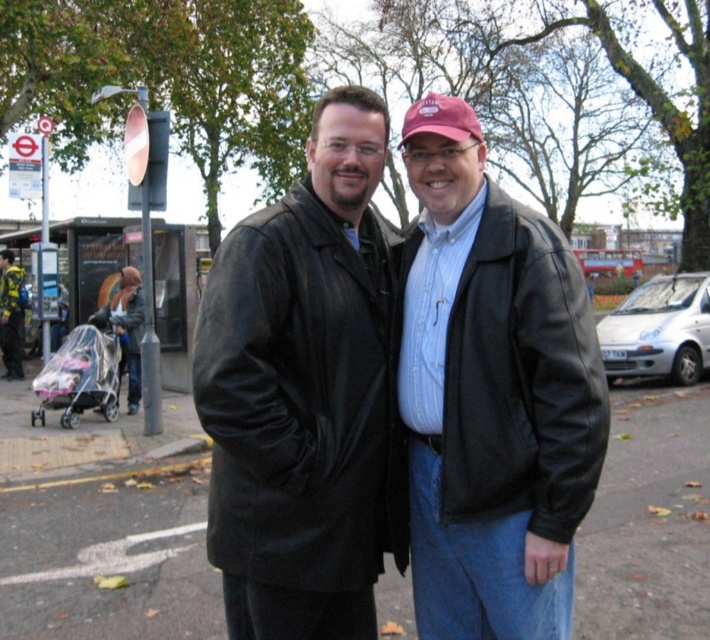
Question: Does matte plastic baby carriage at left have a larger size compared to yellow-green fabric jacket at left?

Choices:
 (A) no
 (B) yes

Answer: (A)

Question: Which object is the closest to the matte plastic baby carriage at left?

Choices:
 (A) yellow-green fabric jacket at left
 (B) black leather jackets at center

Answer: (A)

Question: Does matte plastic baby carriage at left appear over yellow-green fabric jacket at left?

Choices:
 (A) no
 (B) yes

Answer: (A)

Question: Is black leather jackets at center further to the viewer compared to yellow-green fabric jacket at left?

Choices:
 (A) no
 (B) yes

Answer: (A)

Question: Which point is closer to the camera?

Choices:
 (A) (413, 554)
 (B) (9, 337)
 (C) (138, 388)

Answer: (A)

Question: Which of the following is the farthest from the observer?

Choices:
 (A) (114, 332)
 (B) (13, 323)

Answer: (B)